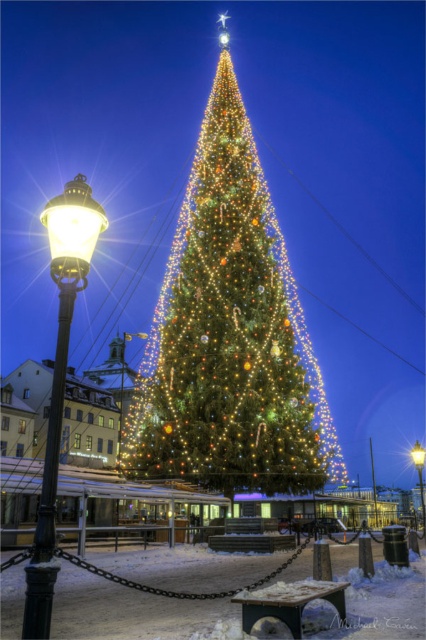
You are standing in the festive scene and want to take a photo of both the metallic streetlamp at center and the matte black lamp post at lower left. Which lamp is closer to you so that it appears larger in the photo?

The metallic streetlamp at center is closer to the viewer than the matte black lamp post at lower left, so it will appear larger in the photo.

You are a city planner reviewing a holiday decoration plan. The city has a rule that all outdoor lamps must be at least 50 meters apart for safety. Based on the scene, do the matte brass streetlamp at left and the matte black lamp post at lower left comply with this regulation?

The matte brass streetlamp at left and the matte black lamp post at lower left are 61.94 meters apart from each other, which exceeds the required 50 meters, so they comply with the safety regulation.